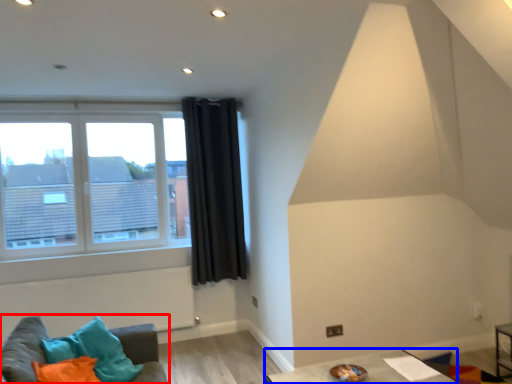
Question: Among these objects, which one is nearest to the camera, studio couch (highlighted by a red box) or table (highlighted by a blue box)?

Choices:
 (A) studio couch
 (B) table

Answer: (A)